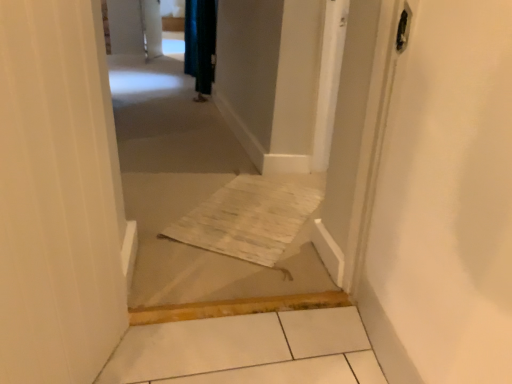
Question: From the image's perspective, is velvet dark green curtain at upper center located above or below neutral carpet at center?

Choices:
 (A) above
 (B) below

Answer: (A)

Question: Is point (206, 77) positioned closer to the camera than point (291, 284)?

Choices:
 (A) closer
 (B) farther

Answer: (B)

Question: Is velvet dark green curtain at upper center taller or shorter than neutral carpet at center?

Choices:
 (A) tall
 (B) short

Answer: (A)

Question: In the image, is neutral carpet at center positioned in front of or behind velvet dark green curtain at upper center?

Choices:
 (A) behind
 (B) front

Answer: (B)

Question: From a real-world perspective, is neutral carpet at center positioned above or below velvet dark green curtain at upper center?

Choices:
 (A) below
 (B) above

Answer: (A)

Question: Which is correct: neutral carpet at center is inside velvet dark green curtain at upper center, or outside of it?

Choices:
 (A) outside
 (B) inside

Answer: (A)

Question: Is neutral carpet at center taller or shorter than velvet dark green curtain at upper center?

Choices:
 (A) short
 (B) tall

Answer: (A)